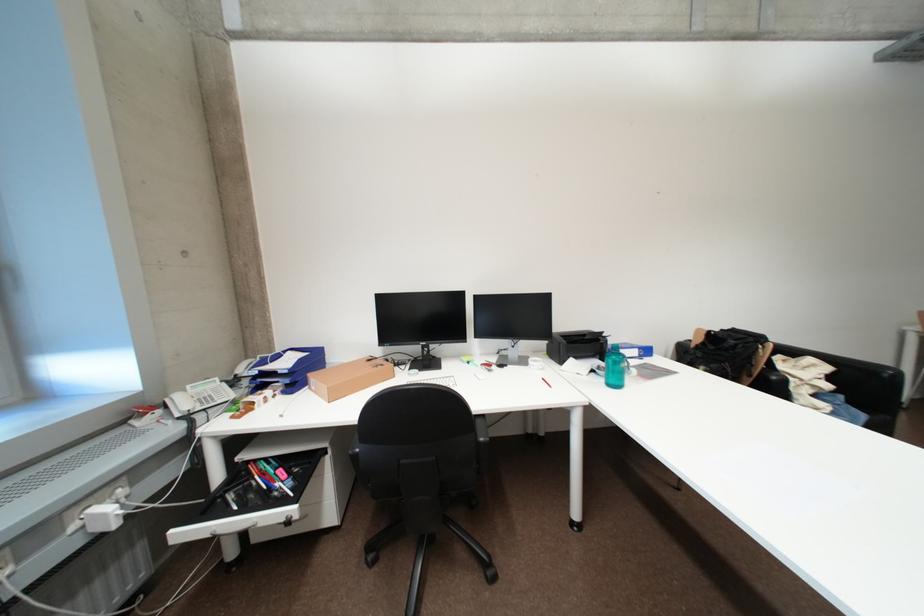
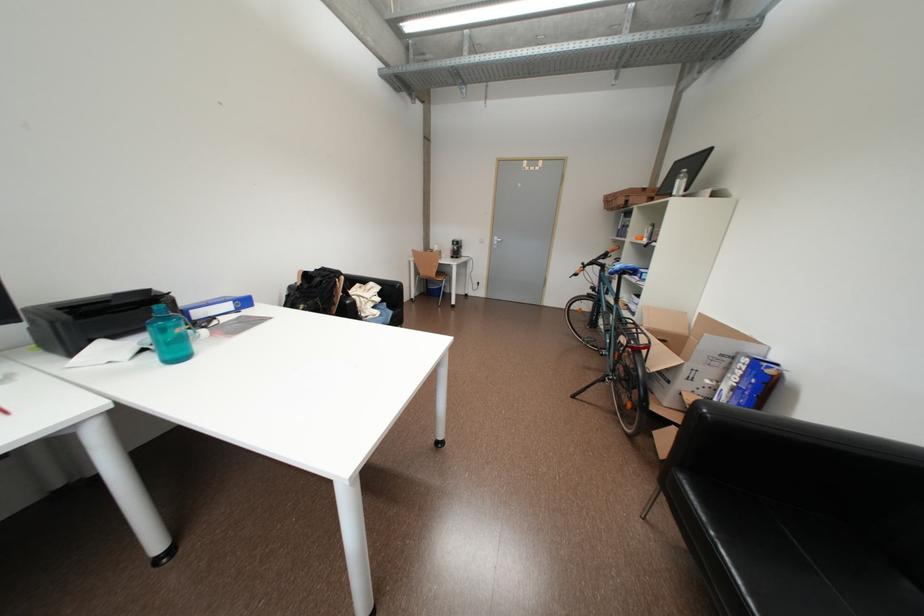
Find the pixel in the second image that matches pixel 744 347 in the first image.

(330, 284)